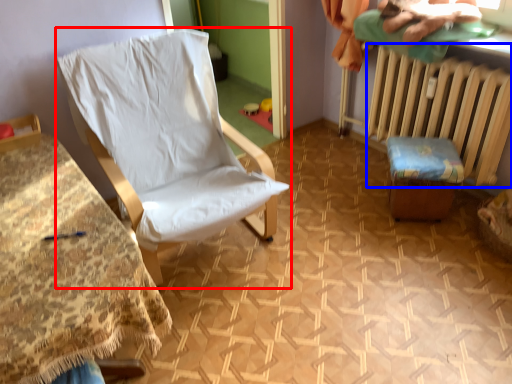
Question: Among these objects, which one is nearest to the camera, chair (highlighted by a red box) or radiator (highlighted by a blue box)?

Choices:
 (A) chair
 (B) radiator

Answer: (A)